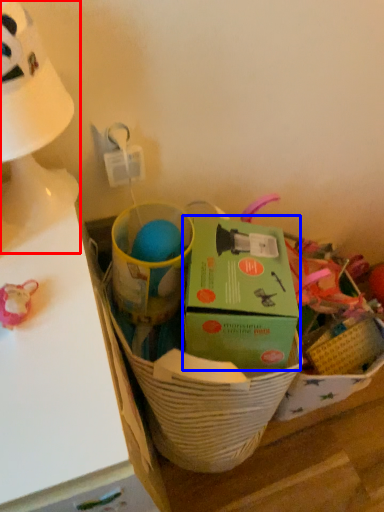
Question: Which point is further to the camera, table lamp (highlighted by a red box) or box (highlighted by a blue box)?

Choices:
 (A) table lamp
 (B) box

Answer: (B)